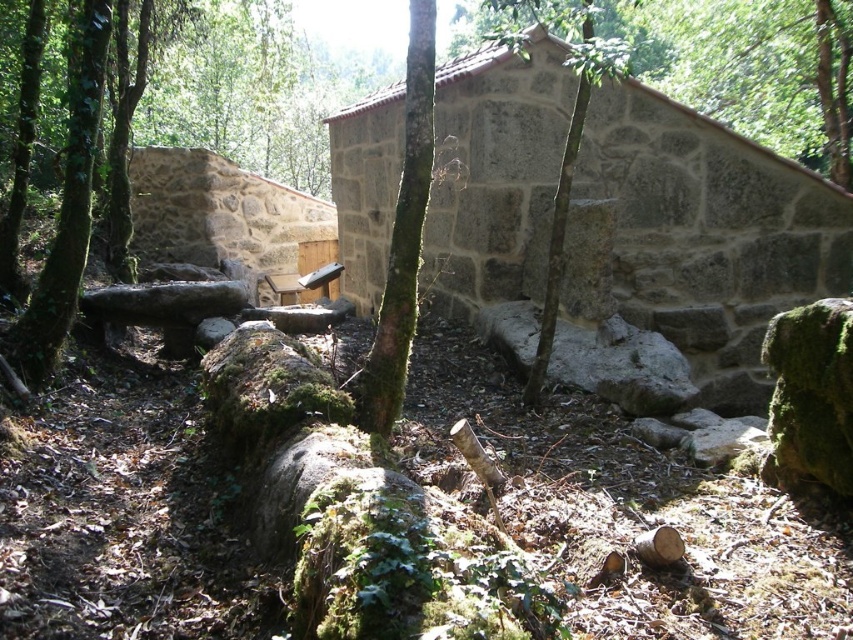
Is point (175, 220) positioned behind point (553, 314)?

Yes, it is.

The image size is (853, 640). Identify the location of rustic stone cabin at center. (225, 214).

Is stone cabin at center bigger than green mossy tree trunk at center?

Yes.

Based on the photo, which of these two, stone cabin at center or green mossy tree trunk at center, stands shorter?

green mossy tree trunk at center

Find the location of a particular element. Image resolution: width=853 pixels, height=640 pixels. stone cabin at center is located at coordinates (709, 234).

Does green mossy bark tree trunk at center have a greater height compared to green mossy tree at center?

Incorrect, green mossy bark tree trunk at center's height is not larger of green mossy tree at center's.

Consider the image. Does green mossy bark tree trunk at center appear on the left side of green mossy tree at center?

Correct, you'll find green mossy bark tree trunk at center to the left of green mossy tree at center.

Describe the element at coordinates (402, 237) in the screenshot. I see `green mossy bark tree trunk at center` at that location.

Find the location of a particular element. green mossy bark tree trunk at center is located at coordinates (402, 237).